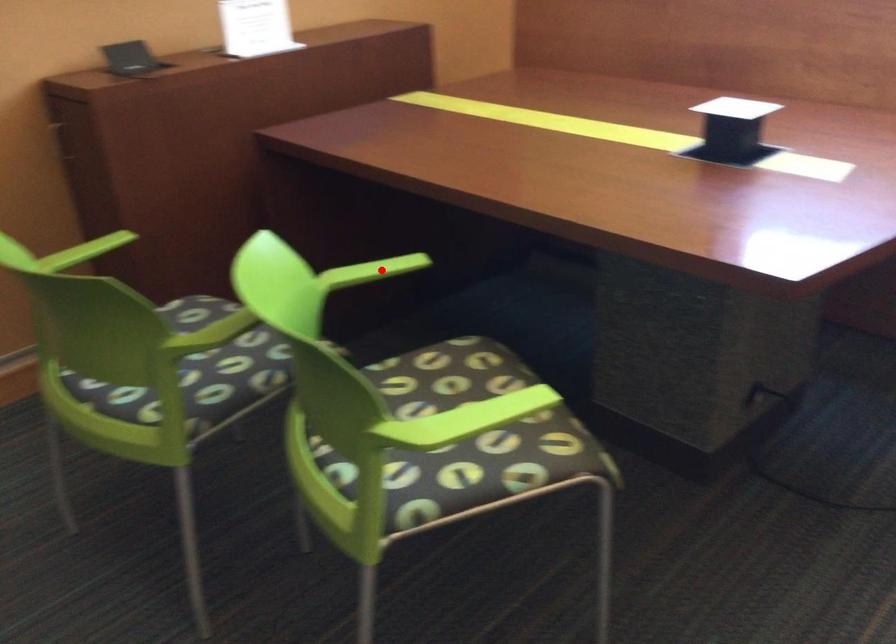
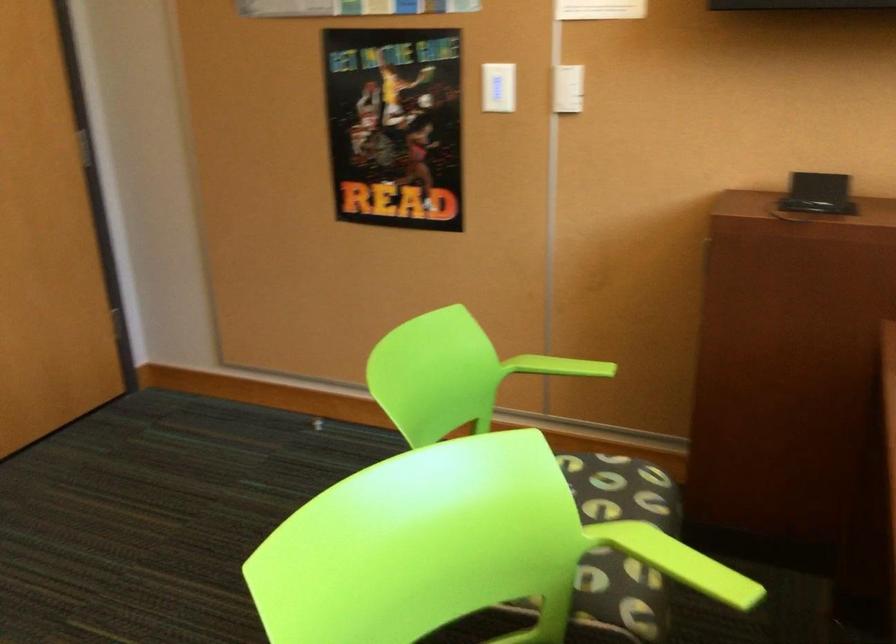
Question: I am providing you with two images of the same scene from different viewpoints. Image1 has a red point marked. In image2, the corresponding 3D location appears at what relative position? Reply with the corresponding letter.

Choices:
 (A) Closer
 (B) Farther

Answer: (A)